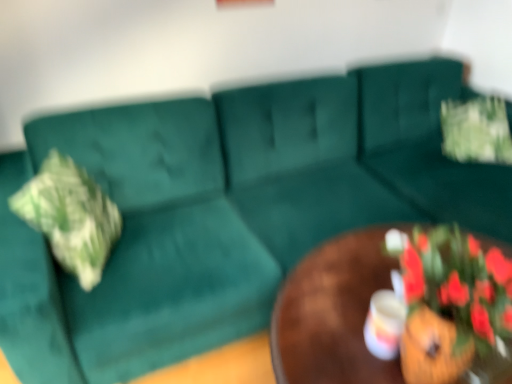
The image size is (512, 384). What are the coordinates of `vacant space situated on the left part of matte white coffee cup at center` in the screenshot? It's located at (328, 346).